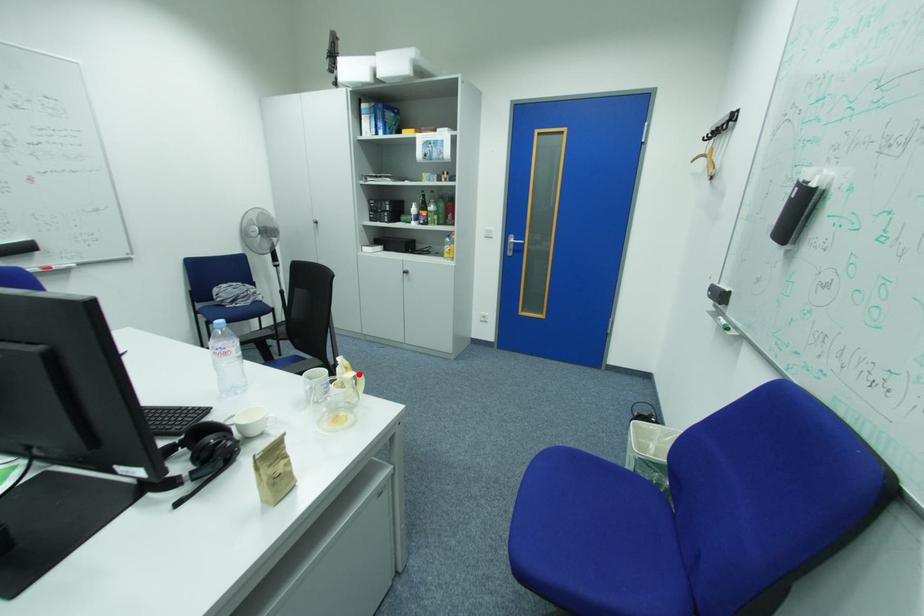
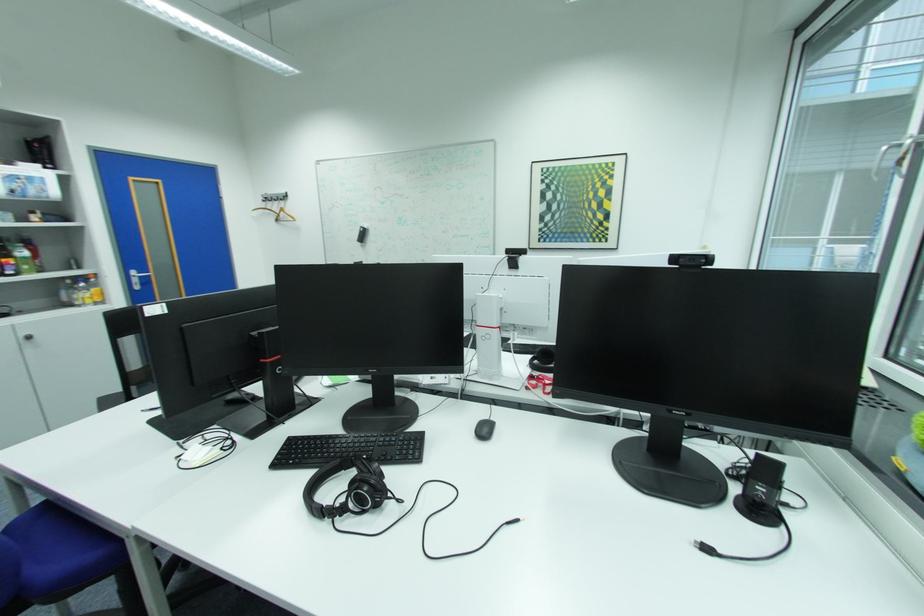
Question: I am providing you with two images of the same scene from different viewpoints. A red point is marked on the first image. Is the red point's position out of view in image 2?

Choices:
 (A) Yes
 (B) No

Answer: (A)